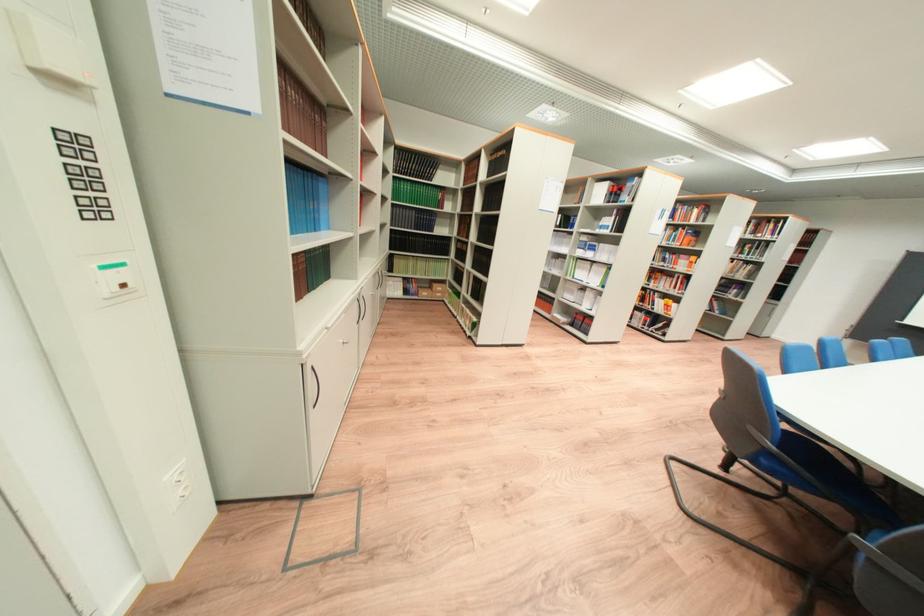
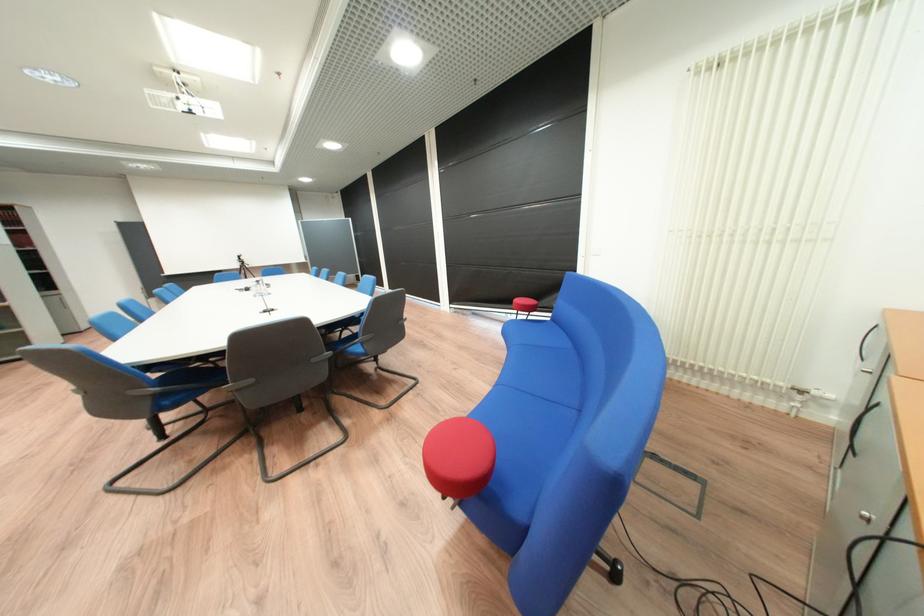
First-person continuous shooting, in which direction is the camera rotating?

The rotation direction of the camera is right-down.